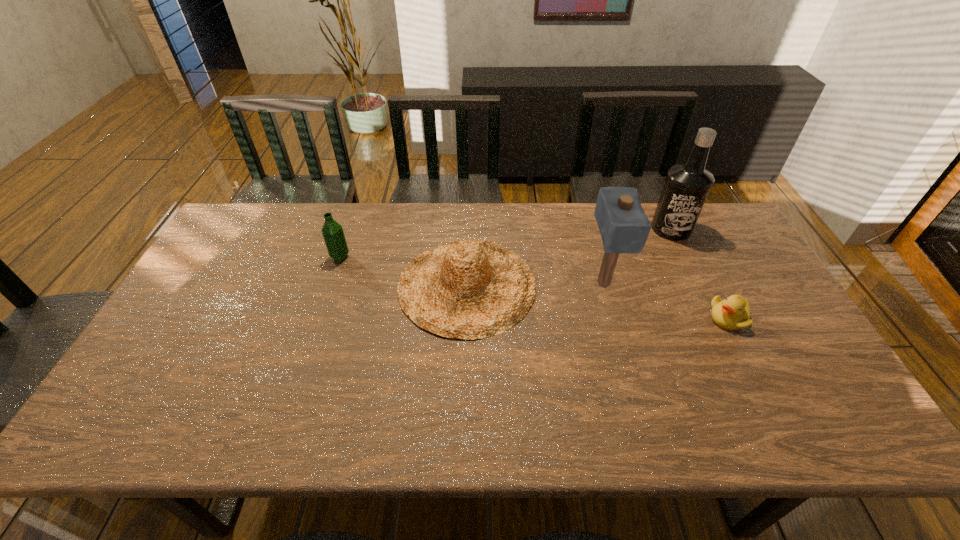
Find the location of `free location located 0.310m on the right of the leftmost object`. free location located 0.310m on the right of the leftmost object is located at coordinates (448, 257).

Where is `vacant region located 0.170m on the right of the fourth object from right to left`? The height and width of the screenshot is (540, 960). vacant region located 0.170m on the right of the fourth object from right to left is located at coordinates (593, 285).

You are a GUI agent. You are given a task and a screenshot of the screen. Output one action in this format:
    pyautogui.click(x=<x>, y=<y>)
    Task: Click on the free location located 0.160m on the beak of the shortest object
    
    Given the screenshot: What is the action you would take?
    pyautogui.click(x=652, y=318)

Where is `free space located on the beak of the shortest object`? The height and width of the screenshot is (540, 960). free space located on the beak of the shortest object is located at coordinates (656, 318).

Locate an element on the screen. vacant region located on the beak of the shortest object is located at coordinates (659, 318).

This screenshot has width=960, height=540. Identify the location of liquor that is positioned at the far edge. (687, 185).

You are a GUI agent. You are given a task and a screenshot of the screen. Output one action in this format:
    pyautogui.click(x=<x>, y=<y>)
    Task: Click on the sunhat present at the far edge
    
    Given the screenshot: What is the action you would take?
    pyautogui.click(x=468, y=289)

Where is `liquor positioned at the right edge`? liquor positioned at the right edge is located at coordinates (687, 185).

You are a GUI agent. You are given a task and a screenshot of the screen. Output one action in this format:
    pyautogui.click(x=<x>, y=<y>)
    Task: Click on the duckling at the right edge
    
    Given the screenshot: What is the action you would take?
    pyautogui.click(x=732, y=313)

Where is `object located in the far right corner section of the desktop`? Image resolution: width=960 pixels, height=540 pixels. object located in the far right corner section of the desktop is located at coordinates (687, 185).